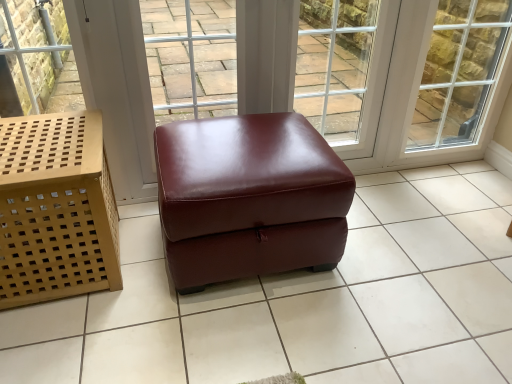
This screenshot has width=512, height=384. In order to click on glossy leather ottoman at center in this screenshot , I will do `click(303, 301)`.

What is the approximate width of burgundy leather ottoman at center?

burgundy leather ottoman at center is 61.68 centimeters wide.

Describe the element at coordinates (249, 198) in the screenshot. The height and width of the screenshot is (384, 512). I see `burgundy leather ottoman at center` at that location.

The height and width of the screenshot is (384, 512). I want to click on glossy leather ottoman at center, so click(303, 301).

Is glossy leather ottoman at center outside of light brown woven basket at left?

glossy leather ottoman at center is positioned outside light brown woven basket at left.

Relative to light brown woven basket at left, is glossy leather ottoman at center in front or behind?

glossy leather ottoman at center is positioned closer to the viewer than light brown woven basket at left.

Is glossy leather ottoman at center next to light brown woven basket at left and touching it?

No, glossy leather ottoman at center is not touching light brown woven basket at left.

From a real-world perspective, is glossy leather ottoman at center below light brown woven basket at left?

Correct, in the physical world, glossy leather ottoman at center is lower than light brown woven basket at left.

Measure the distance between burgundy leather ottoman at center and clear glass window at upper right.

burgundy leather ottoman at center is 4.33 feet from clear glass window at upper right.

Is burgundy leather ottoman at center far from clear glass window at upper right?

Absolutely, burgundy leather ottoman at center is distant from clear glass window at upper right.

Can you tell me how much burgundy leather ottoman at center and clear glass window at upper right differ in facing direction?

0.191 degrees separate the facing orientations of burgundy leather ottoman at center and clear glass window at upper right.

Can you confirm if burgundy leather ottoman at center is shorter than clear glass window at upper right?

Yes, burgundy leather ottoman at center is shorter than clear glass window at upper right.

Is burgundy leather ottoman at center at the back of clear glass window at upper right?

No, burgundy leather ottoman at center is not at the back of clear glass window at upper right.

Is point (467, 42) positioned behind point (180, 205)?

Yes, it is behind point (180, 205).

Between clear glass window at upper right and burgundy leather ottoman at center, which one appears on the left side from the viewer's perspective?

burgundy leather ottoman at center.

Considering the sizes of clear glass window at upper right and burgundy leather ottoman at center in the image, is clear glass window at upper right bigger or smaller than burgundy leather ottoman at center?

Considering their sizes, clear glass window at upper right takes up less space than burgundy leather ottoman at center.

Based on the photo, from a real-world perspective, which is physically below, light brown woven basket at left or glossy leather ottoman at center?

From a 3D spatial view, glossy leather ottoman at center is below.

Relative to glossy leather ottoman at center, is light brown woven basket at left in front or behind?

Visually, light brown woven basket at left is located behind glossy leather ottoman at center.

Is light brown woven basket at left in contact with glossy leather ottoman at center?

light brown woven basket at left is not next to glossy leather ottoman at center, and they're not touching.

The image size is (512, 384). I want to click on furniture in front of the clear glass window at upper right, so click(56, 209).

From a real-world perspective, is clear glass window at upper right beneath light brown woven basket at left?

No, from a real-world perspective, clear glass window at upper right is not beneath light brown woven basket at left.

Considering the relative positions of clear glass window at upper right and light brown woven basket at left in the image provided, is clear glass window at upper right to the right of light brown woven basket at left from the viewer's perspective?

Indeed, clear glass window at upper right is positioned on the right side of light brown woven basket at left.

Does point (445, 8) lie in front of point (42, 183)?

That is False.

Is burgundy leather ottoman at center facing away from glossy leather ottoman at center?

No.

From the image's perspective, is burgundy leather ottoman at center above or below glossy leather ottoman at center?

Based on their image positions, burgundy leather ottoman at center is located above glossy leather ottoman at center.

Which is in front, burgundy leather ottoman at center or glossy leather ottoman at center?

glossy leather ottoman at center is in front.

From a real-world perspective, which object stands above the other?

From a 3D spatial view, burgundy leather ottoman at center is above.

Does point (290, 184) come behind point (80, 277)?

No, (290, 184) is in front of (80, 277).

Identify the location of stool above the light brown woven basket at left (from the image's perspective). This screenshot has width=512, height=384. (249, 198).

Considering their positions, is burgundy leather ottoman at center located in front of or behind light brown woven basket at left?

burgundy leather ottoman at center is positioned farther from the viewer than light brown woven basket at left.

In the image, there is a glossy leather ottoman at center. Where is `furniture above it (from the image's perspective)`? Image resolution: width=512 pixels, height=384 pixels. furniture above it (from the image's perspective) is located at coordinates (56, 209).

The width and height of the screenshot is (512, 384). What are the coordinates of `stool that appears below the clear glass window at upper right (from a real-world perspective)` in the screenshot? It's located at (249, 198).

Considering their positions, is burgundy leather ottoman at center positioned further to glossy leather ottoman at center than clear glass window at upper right?

clear glass window at upper right is further to glossy leather ottoman at center.

Considering their positions, is glossy leather ottoman at center positioned further to clear glass window at upper right than burgundy leather ottoman at center?

burgundy leather ottoman at center lies further to clear glass window at upper right than the other object.

Based on their spatial positions, is burgundy leather ottoman at center or light brown woven basket at left further from clear glass window at upper right?

Based on the image, light brown woven basket at left appears to be further to clear glass window at upper right.

Based on their spatial positions, is clear glass window at upper right or burgundy leather ottoman at center further from glossy leather ottoman at center?

The object further to glossy leather ottoman at center is clear glass window at upper right.

Estimate the real-world distances between objects in this image. Which object is closer to clear glass window at upper right, light brown woven basket at left or glossy leather ottoman at center?

The object closer to clear glass window at upper right is glossy leather ottoman at center.

When comparing their distances from burgundy leather ottoman at center, does light brown woven basket at left or clear glass window at upper right seem closer?

The object closer to burgundy leather ottoman at center is light brown woven basket at left.

Which object lies further to the anchor point burgundy leather ottoman at center, clear glass window at upper right or glossy leather ottoman at center?

clear glass window at upper right lies further to burgundy leather ottoman at center than the other object.

Which object lies further to the anchor point clear glass window at upper right, light brown woven basket at left or burgundy leather ottoman at center?

light brown woven basket at left.

Image resolution: width=512 pixels, height=384 pixels. Identify the location of tile between burgundy leather ottoman at center and clear glass window at upper right in the horizontal direction. (303, 301).

This screenshot has width=512, height=384. In order to click on stool between light brown woven basket at left and glossy leather ottoman at center in this screenshot , I will do `click(249, 198)`.

The image size is (512, 384). I want to click on tile located between light brown woven basket at left and clear glass window at upper right in the left-right direction, so click(x=303, y=301).

I want to click on stool between light brown woven basket at left and clear glass window at upper right in the horizontal direction, so click(x=249, y=198).